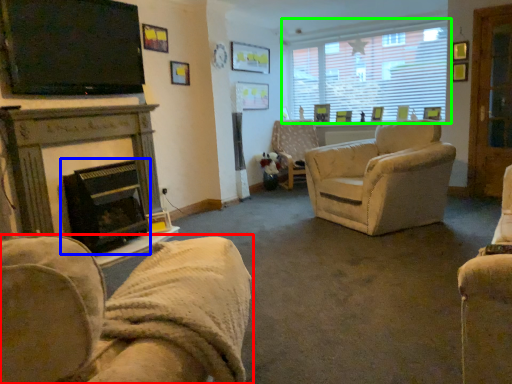
Question: Estimate the real-world distances between objects in this image. Which object is farther from chair (highlighted by a red box), fireplace (highlighted by a blue box) or window (highlighted by a green box)?

Choices:
 (A) fireplace
 (B) window

Answer: (B)